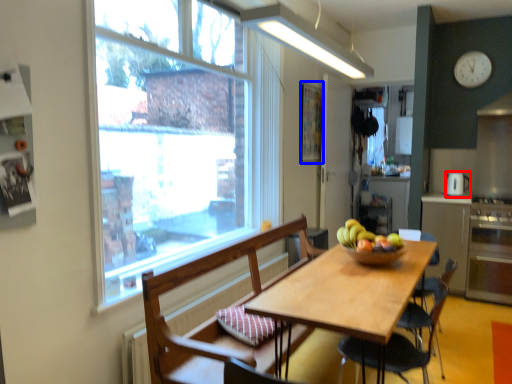
Question: Among these objects, which one is farthest to the camera, coffee machine (highlighted by a red box) or bulletin board (highlighted by a blue box)?

Choices:
 (A) coffee machine
 (B) bulletin board

Answer: (A)